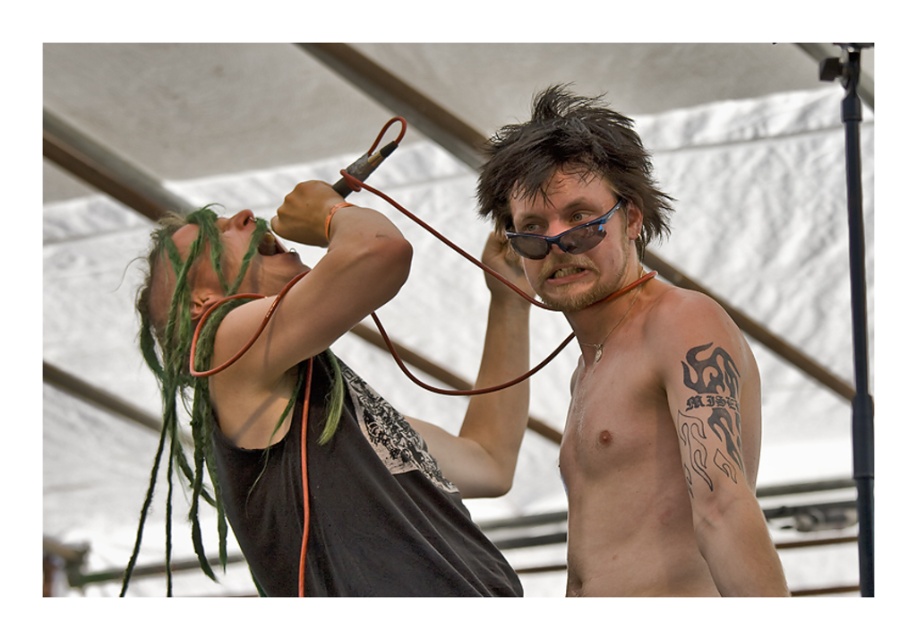
Based on the scene description, if you were to compare the sizes of the dark brown hair at upper center and the blue plastic goggles at center, which one is larger?

The dark brown hair at upper center is bigger than the blue plastic goggles at center according to the description.

You are a photographer at the event and want to capture a photo where both the black matte shirt at center and the blue plastic goggles at center are visible. Based on their positions, which one should you focus on first to ensure both are in frame?

The black matte shirt at center is below the blue plastic goggles at center, so you should focus on the blue plastic goggles at center first to ensure both are in frame.